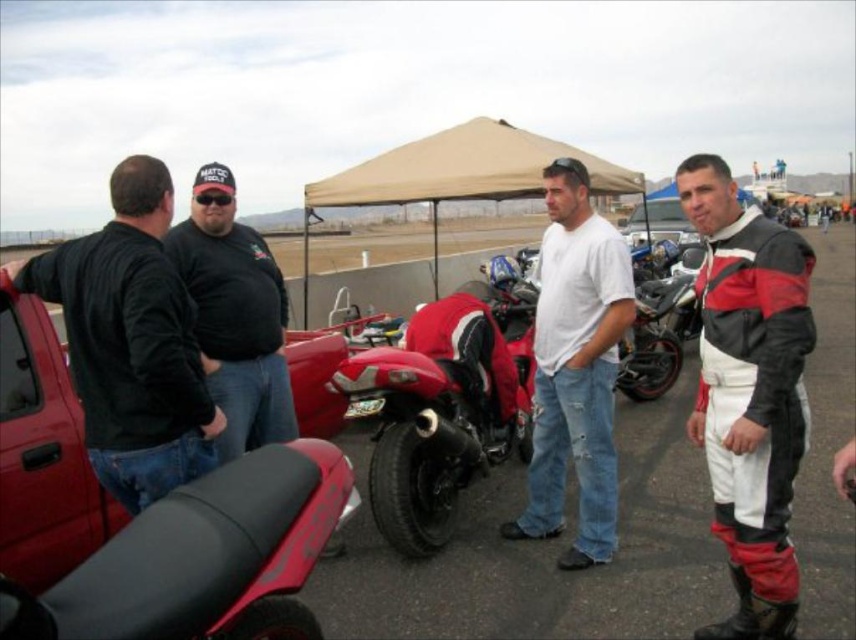
Is black rubber motorcycle at center taller than shiny red motorcycle at center?

Yes, black rubber motorcycle at center is taller than shiny red motorcycle at center.

How far apart are black rubber motorcycle at center and shiny red motorcycle at center?

The distance of black rubber motorcycle at center from shiny red motorcycle at center is 1.58 meters.

Between point (498, 508) and point (414, 518), which one is positioned behind?

Positioned behind is point (498, 508).

You are a GUI agent. You are given a task and a screenshot of the screen. Output one action in this format:
    pyautogui.click(x=<x>, y=<y>)
    Task: Click on the black rubber motorcycle at center
    
    Given the screenshot: What is the action you would take?
    pyautogui.click(x=544, y=552)

The height and width of the screenshot is (640, 856). What do you see at coordinates (131, 340) in the screenshot?
I see `black leather jacket at left` at bounding box center [131, 340].

Does black leather jacket at left appear under shiny red motorcycle at center?

No.

Locate an element on the screen. black leather jacket at left is located at coordinates coord(131,340).

Between shiny red motorcycle at center and white cotton t-shirt at center, which one has less height?

Standing shorter between the two is shiny red motorcycle at center.

Who is positioned more to the right, shiny red motorcycle at center or white cotton t-shirt at center?

white cotton t-shirt at center

Which is in front, point (357, 397) or point (574, 224)?

Point (574, 224)

In order to click on shiny red motorcycle at center in this screenshot , I will do `click(441, 406)`.